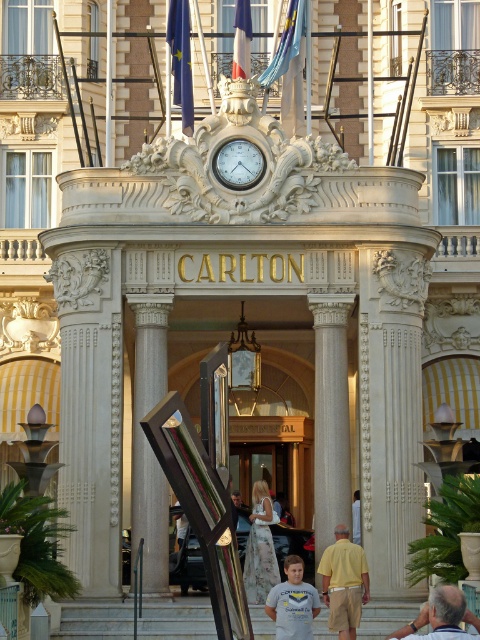
Does point (396, 636) lie in front of point (231, 154)?

Yes, point (396, 636) is closer to viewer.

Can you confirm if light brown leather chair at lower right is smaller than gold metallic clock at center?

Actually, light brown leather chair at lower right might be larger than gold metallic clock at center.

Where is `light brown leather chair at lower right`? light brown leather chair at lower right is located at coordinates point(442,616).

Does white marble pillar at center have a lesser width compared to yellow cotton shirt at center?

No.

Who is more forward, (x=334, y=464) or (x=360, y=556)?

Point (x=360, y=556) is more forward.

At what (x,y) coordinates should I click in order to perform the action: click on white marble pillar at center. Please return your answer as a coordinate pair (x, y). Looking at the image, I should click on (331, 416).

Between floral dress at center and gray cotton t-shirt at center, which one is positioned higher?

floral dress at center

Looking at this image, does floral dress at center have a lesser width compared to gray cotton t-shirt at center?

Correct, floral dress at center's width is less than gray cotton t-shirt at center's.

Which is in front, point (243, 579) or point (302, 593)?

Point (302, 593)

Find the location of `floral dress at center`. floral dress at center is located at coordinates (260, 547).